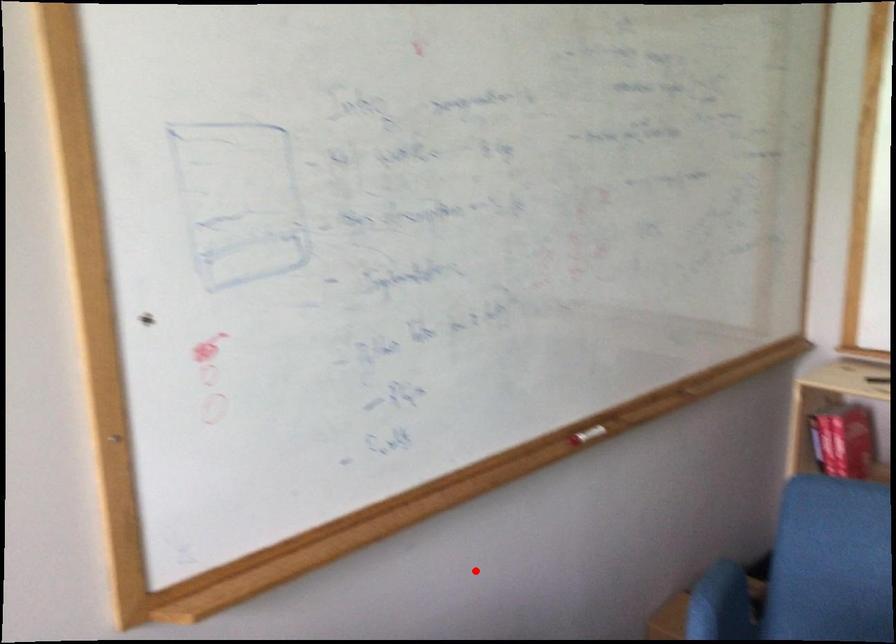
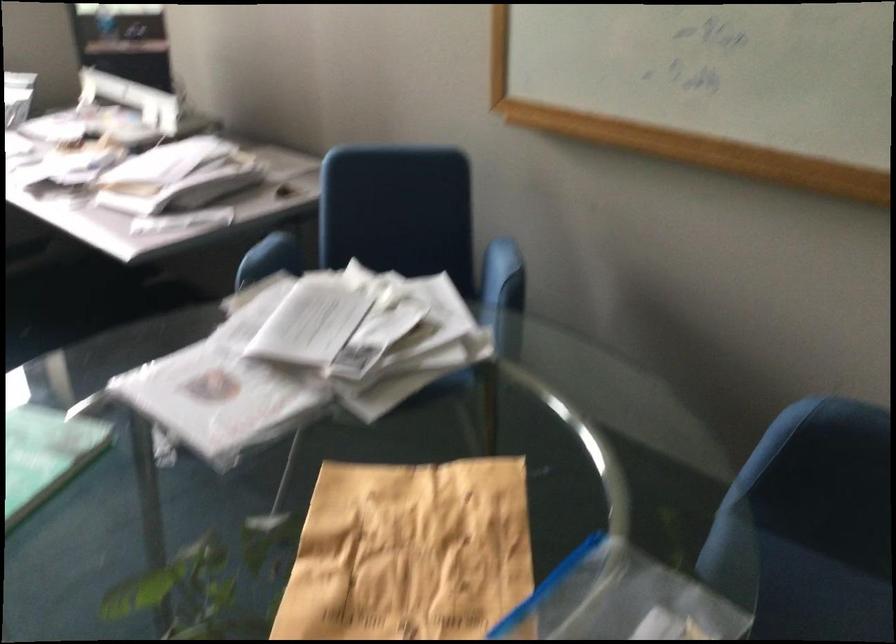
Locate, in the second image, the point that corresponds to the highlighted location in the first image.

(785, 270)